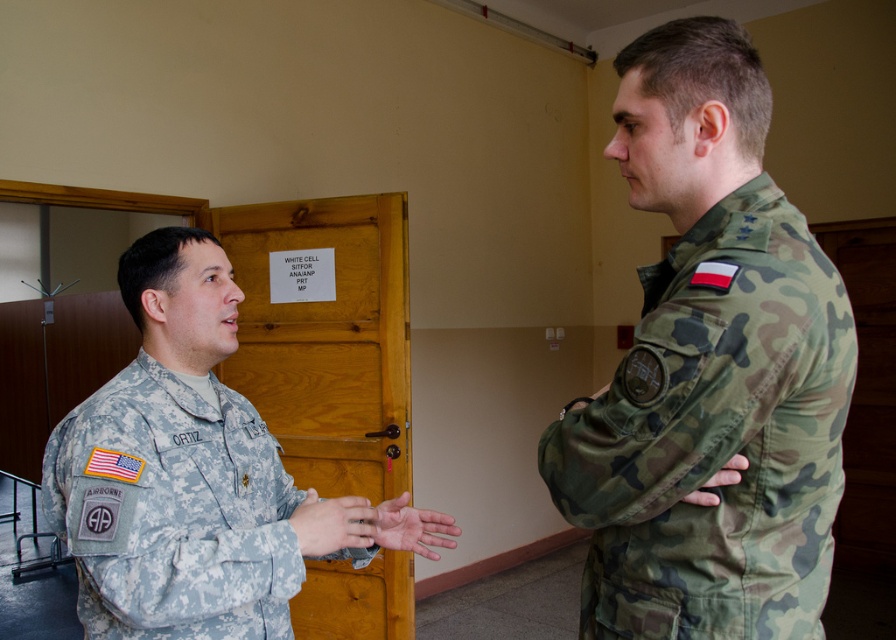
Question: Is the position of camo fabric uniform at right less distant than that of camouflage uniform at center?

Choices:
 (A) yes
 (B) no

Answer: (A)

Question: Is camouflage uniform at center to the right of matte military uniform at center from the viewer's perspective?

Choices:
 (A) no
 (B) yes

Answer: (A)

Question: In this image, where is matte military uniform at center located relative to smooth skin hand at center?

Choices:
 (A) left
 (B) right

Answer: (A)

Question: Which object is positioned closest to the camouflage uniform at center?

Choices:
 (A) camouflage fabric hand at center
 (B) matte military uniform at center
 (C) smooth skin hand at center

Answer: (B)

Question: Which of the following is the farthest from the observer?

Choices:
 (A) matte military uniform at center
 (B) camouflage uniform at center

Answer: (A)

Question: Considering the real-world distances, which object is farthest from the matte military uniform at center?

Choices:
 (A) camouflage fabric hand at center
 (B) camo fabric uniform at right
 (C) smooth skin hand at center
 (D) camouflage uniform at center

Answer: (A)